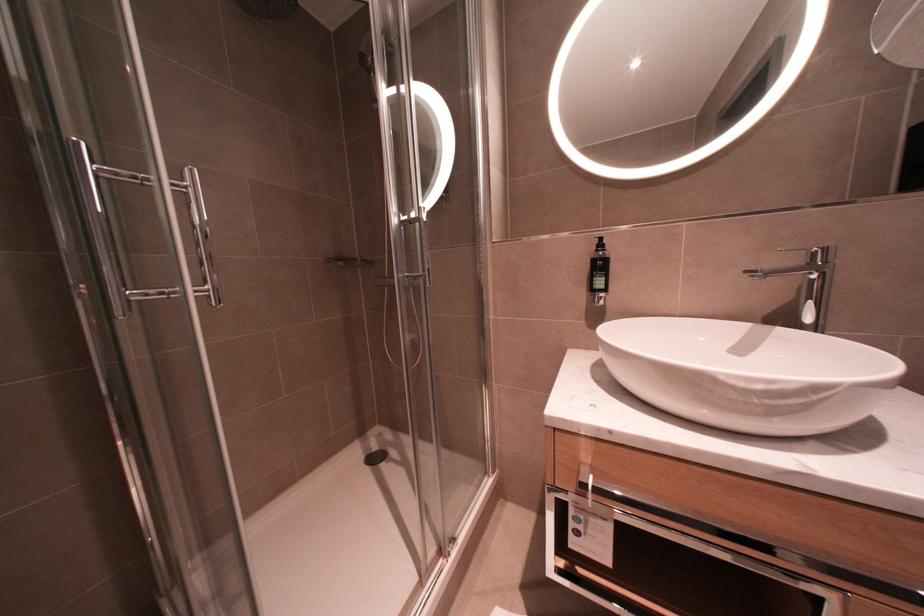
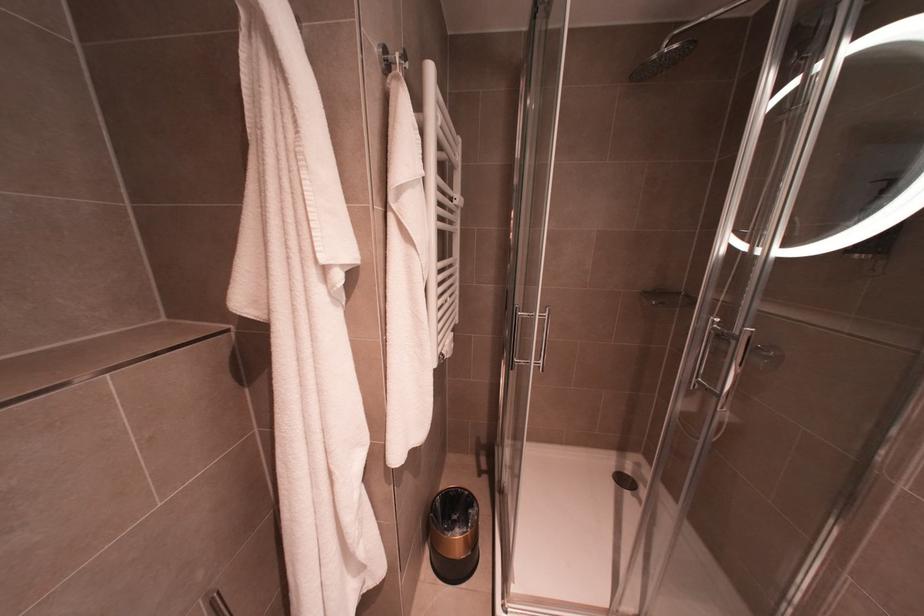
Question: The first image is from the beginning of the video and the second image is from the end. How did the camera likely rotate when shooting the video?

Choices:
 (A) Left
 (B) Right
 (C) Up
 (D) Down

Answer: (A)